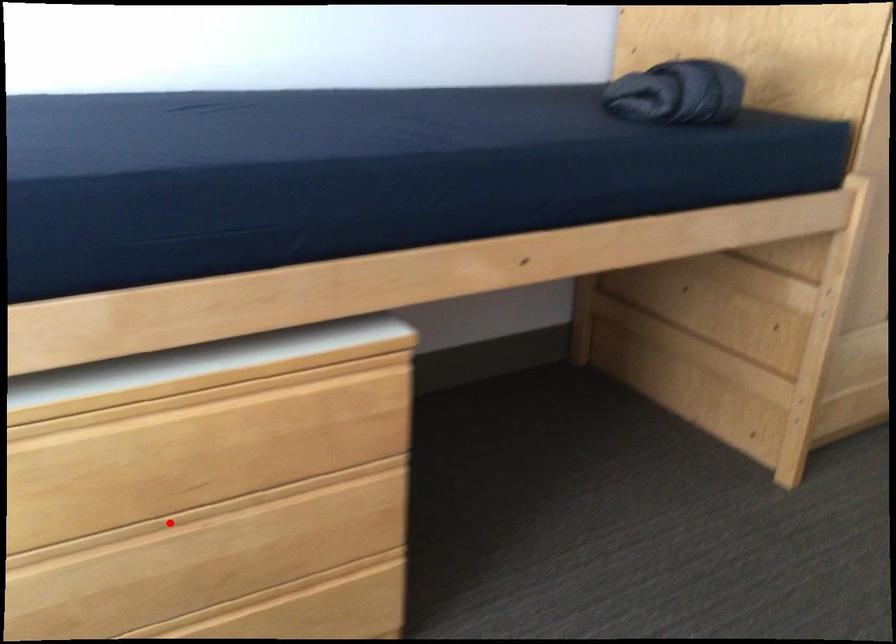
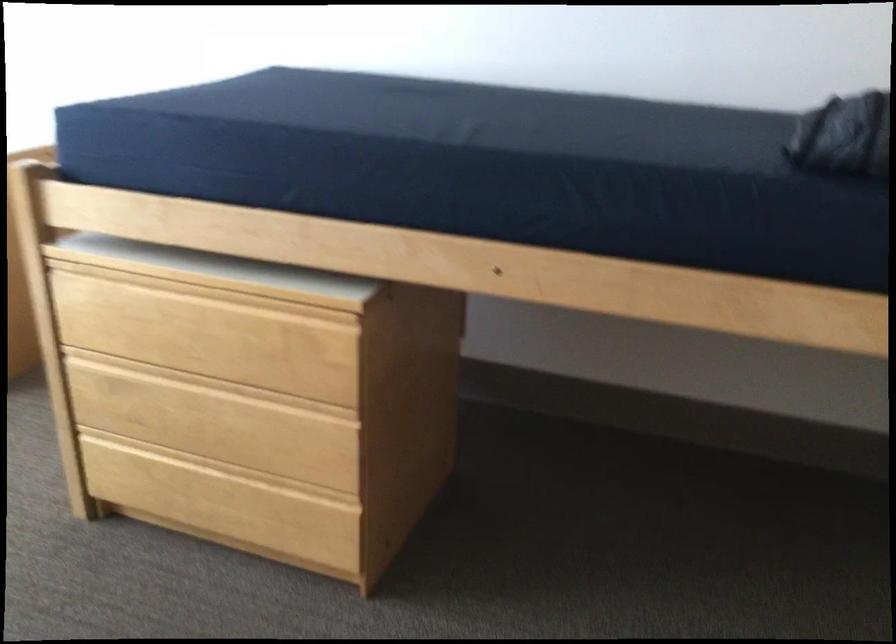
Question: I am providing you with two images of the same scene from different viewpoints. In image1, a red point is highlighted. Considering the same 3D point in image2, which of the following is correct?

Choices:
 (A) It is closer
 (B) It is farther

Answer: (B)